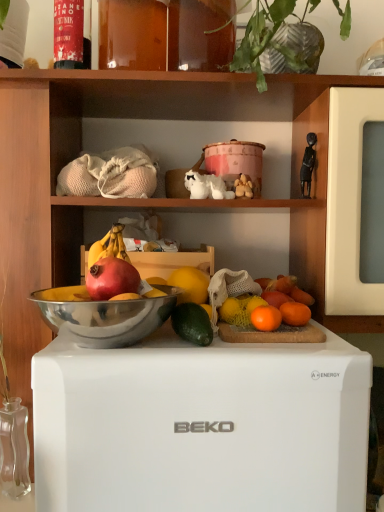
The width and height of the screenshot is (384, 512). Find the location of `vacant space in front of red matte grapefruit at center, positioned as the 1th grapefruit in front-to-back order`. vacant space in front of red matte grapefruit at center, positioned as the 1th grapefruit in front-to-back order is located at coordinates (98, 350).